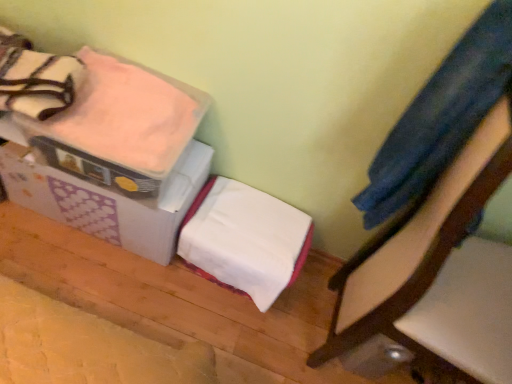
Question: From a real-world perspective, relative to white soft blanket at center, marked as the first blanket in a bottom-to-top arrangement, is pink soft fabric blanket at upper left, the second blanket when ordered from bottom to top, vertically above or below?

Choices:
 (A) below
 (B) above

Answer: (B)

Question: Relative to white soft blanket at center, marked as the first blanket in a bottom-to-top arrangement, is pink soft fabric blanket at upper left, the 1th blanket in the top-to-bottom sequence, in front or behind?

Choices:
 (A) behind
 (B) front

Answer: (B)

Question: Estimate the real-world distances between objects in this image. Which object is farther from the white cardboard box at upper left?

Choices:
 (A) denim fabric pants at upper right
 (B) wooden chair at right
 (C) white soft blanket at center, the 2th blanket viewed from the top
 (D) pink soft fabric blanket at upper left, the 1th blanket in the top-to-bottom sequence

Answer: (B)

Question: Estimate the real-world distances between objects in this image. Which object is closer to the denim fabric pants at upper right?

Choices:
 (A) white cardboard box at upper left
 (B) pink soft fabric blanket at upper left, the second blanket when ordered from bottom to top
 (C) wooden chair at right
 (D) white soft blanket at center, the 2th blanket viewed from the top

Answer: (C)